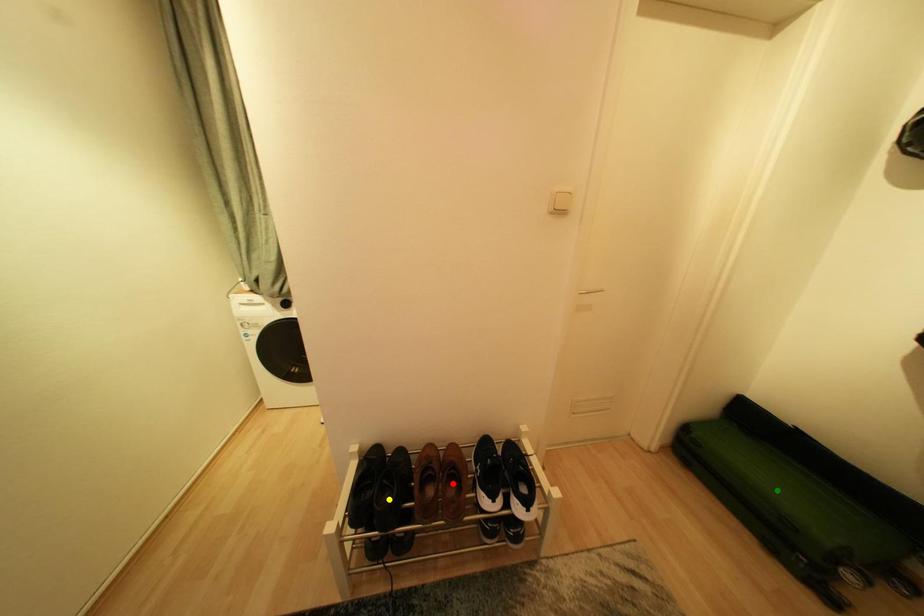
Order these from nearest to farthest:
A) yellow point
B) green point
C) red point

1. green point
2. yellow point
3. red point